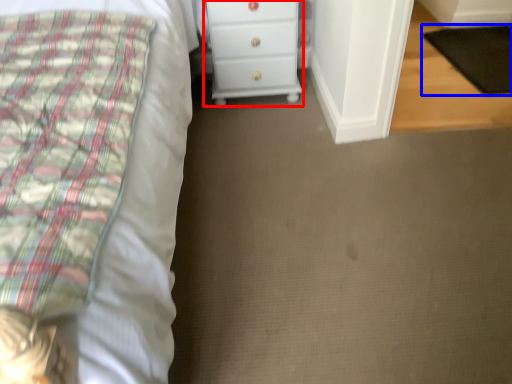
Question: Which object is closer to the camera taking this photo, chest of drawers (highlighted by a red box) or pad (highlighted by a blue box)?

Choices:
 (A) chest of drawers
 (B) pad

Answer: (A)